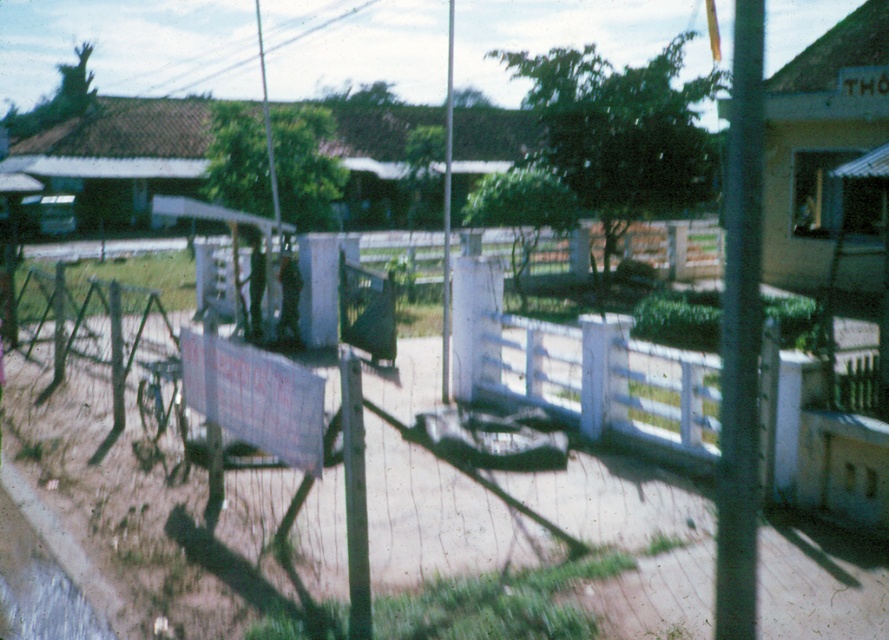
Which is above, black metal pole at right or white plastic fence at center?

Positioned higher is white plastic fence at center.

Where is `black metal pole at right`? black metal pole at right is located at coordinates (741, 336).

Does point (733, 337) come closer to viewer compared to point (443, 180)?

Yes, it is in front of point (443, 180).

Find the location of a particular element. black metal pole at right is located at coordinates (741, 336).